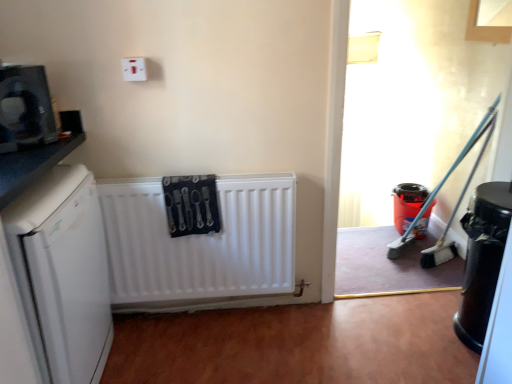
Question: Is matte plastic bucket at right, the 3th appliance positioned from the left, further to camera compared to white plastic electric outlet at upper center?

Choices:
 (A) no
 (B) yes

Answer: (B)

Question: From the image's perspective, would you say matte plastic bucket at right, the first appliance from the back, is shown under white plastic electric outlet at upper center?

Choices:
 (A) no
 (B) yes

Answer: (B)

Question: From the image's perspective, would you say matte plastic bucket at right, marked as the first appliance in a right-to-left arrangement, is positioned over white plastic electric outlet at upper center?

Choices:
 (A) no
 (B) yes

Answer: (A)

Question: Considering the relative sizes of matte plastic bucket at right, marked as the first appliance in a right-to-left arrangement, and white plastic electric outlet at upper center in the image provided, is matte plastic bucket at right, marked as the first appliance in a right-to-left arrangement, bigger than white plastic electric outlet at upper center?

Choices:
 (A) no
 (B) yes

Answer: (B)

Question: Does matte plastic bucket at right, acting as the third appliance starting from the front, come in front of white plastic electric outlet at upper center?

Choices:
 (A) no
 (B) yes

Answer: (A)

Question: Is matte plastic bucket at right, marked as the first appliance in a right-to-left arrangement, thinner than white plastic electric outlet at upper center?

Choices:
 (A) no
 (B) yes

Answer: (A)

Question: From the image's perspective, is black glossy trash can at lower right, acting as the second appliance starting from the left, on white matte dishwasher at left?

Choices:
 (A) yes
 (B) no

Answer: (B)

Question: From a real-world perspective, is black glossy trash can at lower right, the second appliance when ordered from back to front, located beneath white matte dishwasher at left?

Choices:
 (A) no
 (B) yes

Answer: (B)

Question: Does black glossy trash can at lower right, acting as the second appliance starting from the left, have a lesser height compared to white matte dishwasher at left?

Choices:
 (A) no
 (B) yes

Answer: (B)

Question: Is black glossy trash can at lower right, which ranks as the second appliance in front-to-back order, positioned far away from white matte dishwasher at left?

Choices:
 (A) yes
 (B) no

Answer: (A)

Question: From a real-world perspective, is black glossy trash can at lower right, which ranks as the second appliance in front-to-back order, located higher than white matte dishwasher at left?

Choices:
 (A) no
 (B) yes

Answer: (A)

Question: Considering the relative sizes of black glossy trash can at lower right, acting as the second appliance starting from the left, and white matte dishwasher at left in the image provided, is black glossy trash can at lower right, acting as the second appliance starting from the left, taller than white matte dishwasher at left?

Choices:
 (A) yes
 (B) no

Answer: (B)

Question: Can we say matte black microwave at upper left, the third appliance from the back, lies outside white matte dishwasher at left?

Choices:
 (A) yes
 (B) no

Answer: (A)